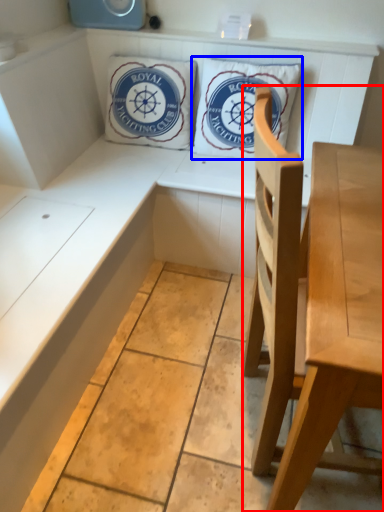
Question: Which object appears closest to the camera in this image, chair (highlighted by a red box) or pillow (highlighted by a blue box)?

Choices:
 (A) chair
 (B) pillow

Answer: (A)